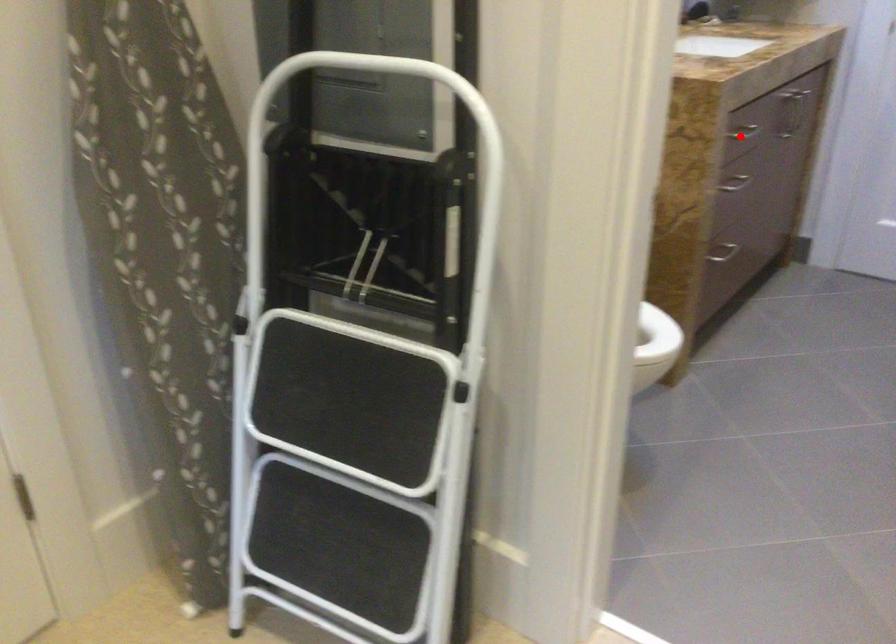
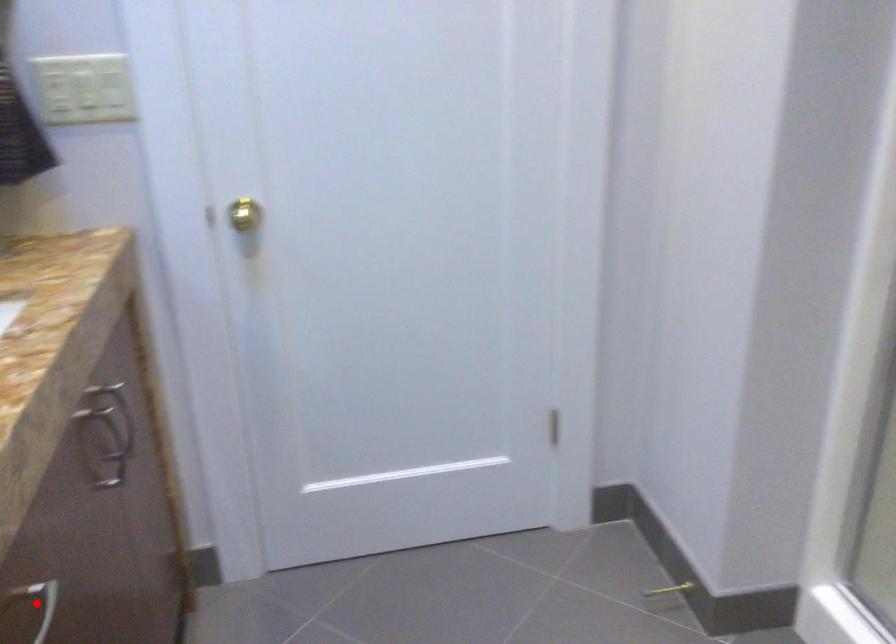
I am providing you with two images of the same scene from different viewpoints. A red point is marked on the first image and another point is marked on the second image. Do the highlighted points in image1 and image2 indicate the same real-world spot?

Yes